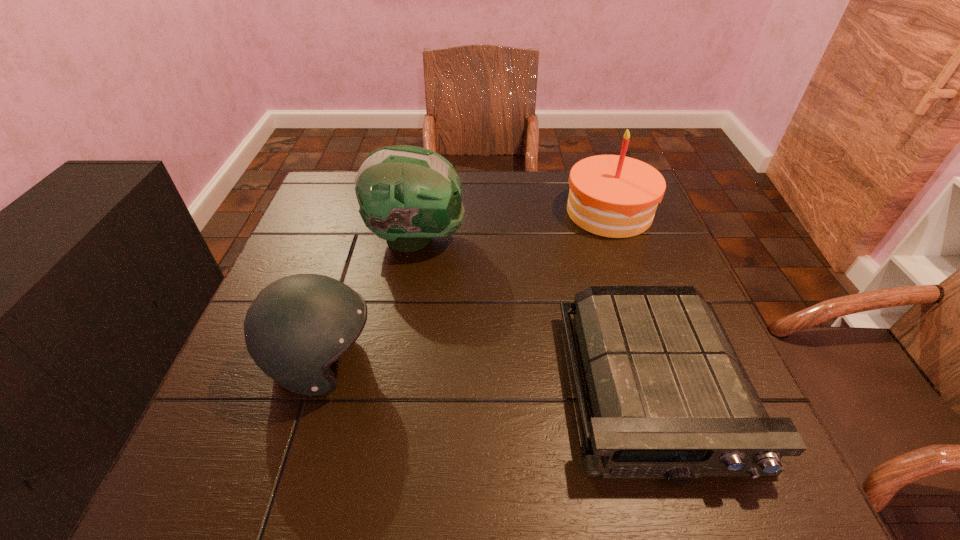
I want to click on the taller football helmet, so click(x=407, y=195).

Locate an element on the screen. birthday cake is located at coordinates (615, 196).

Locate an element on the screen. The width and height of the screenshot is (960, 540). the third tallest object is located at coordinates (297, 326).

Find the location of a particular element. the nearer football helmet is located at coordinates (297, 326).

The width and height of the screenshot is (960, 540). In order to click on radio receiver in this screenshot , I will do `click(670, 398)`.

Image resolution: width=960 pixels, height=540 pixels. In order to click on blank space located on the visor of the taller football helmet in this screenshot , I will do `click(543, 239)`.

Locate an element on the screen. Image resolution: width=960 pixels, height=540 pixels. vacant space located on the left of the birthday cake is located at coordinates (453, 212).

This screenshot has height=540, width=960. Find the location of `free space located 0.100m at the face opening of the second shortest object`. free space located 0.100m at the face opening of the second shortest object is located at coordinates (429, 363).

You are a GUI agent. You are given a task and a screenshot of the screen. Output one action in this format:
    pyautogui.click(x=<x>, y=<y>)
    Task: Click on the football helmet that is at the far edge
    This screenshot has height=540, width=960.
    Given the screenshot: What is the action you would take?
    pyautogui.click(x=407, y=195)

The image size is (960, 540). I want to click on birthday cake at the far edge, so click(615, 196).